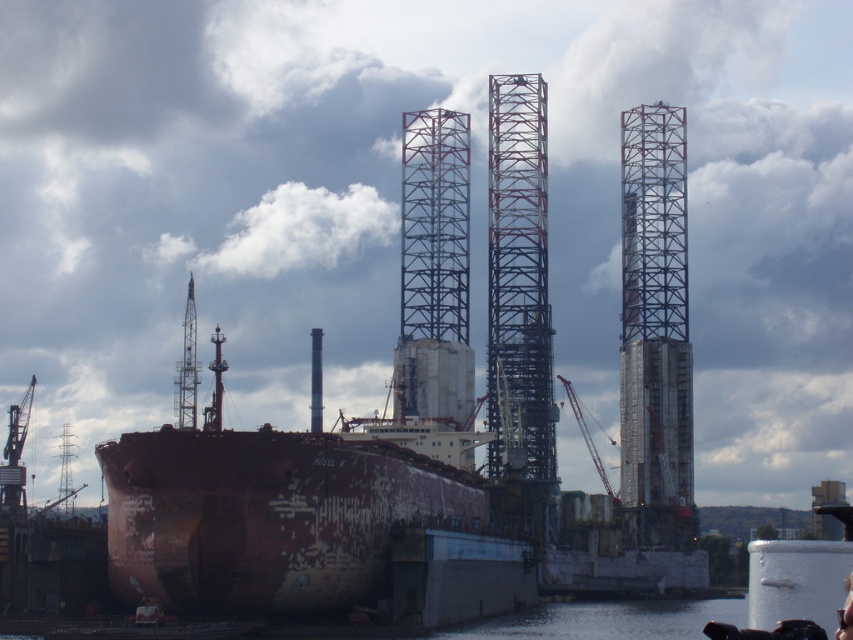
Question: Does clear water at lower center appear over metallic gray crane at center?

Choices:
 (A) no
 (B) yes

Answer: (A)

Question: Among these objects, which one is farthest from the camera?

Choices:
 (A) clear water at lower center
 (B) rusty metal crane at center

Answer: (B)

Question: Estimate the real-world distances between objects in this image. Which object is farther from the clear water at lower center?

Choices:
 (A) rusty metal crane at center
 (B) metallic gray crane at center

Answer: (A)

Question: Which point is closer to the camera?

Choices:
 (A) (190, 330)
 (B) (704, 611)
 (C) (581, 426)

Answer: (B)

Question: Is clear water at lower center positioned in front of metallic gray crane at center?

Choices:
 (A) no
 (B) yes

Answer: (B)

Question: Is clear water at lower center above metallic gray crane at center?

Choices:
 (A) yes
 (B) no

Answer: (B)